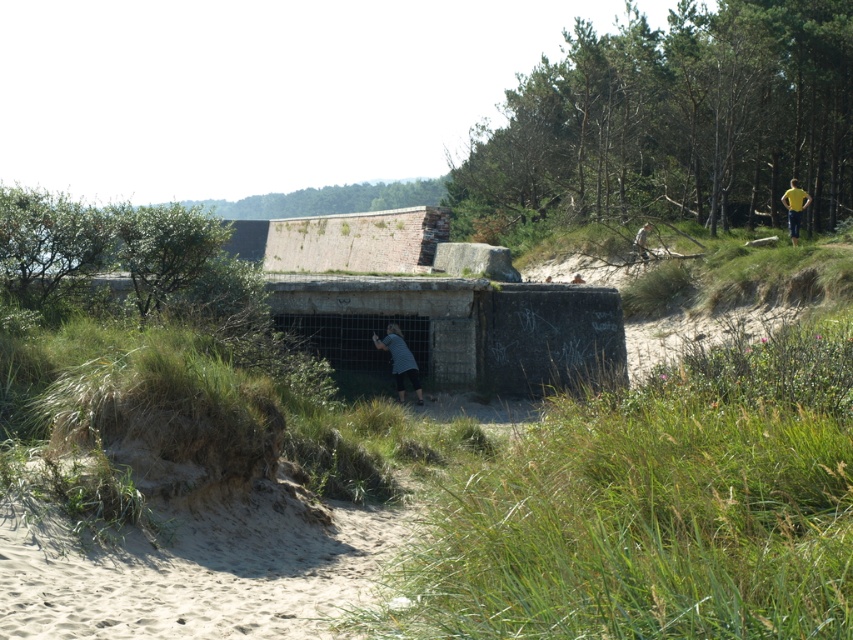
Question: Which point is farther to the camera?

Choices:
 (A) (409, 371)
 (B) (791, 196)
 (C) (642, 230)

Answer: (C)

Question: Is yellow fabric shirt at upper right above yellow shirt at upper right?

Choices:
 (A) yes
 (B) no

Answer: (A)

Question: Which object is closer to the camera taking this photo?

Choices:
 (A) yellow fabric shirt at upper right
 (B) yellow shirt at upper right

Answer: (A)

Question: Which of the following is the farthest from the observer?

Choices:
 (A) (641, 248)
 (B) (398, 371)
 (C) (795, 244)

Answer: (A)

Question: Can you confirm if gray striped shirt at center is positioned above yellow fabric shirt at upper right?

Choices:
 (A) no
 (B) yes

Answer: (A)

Question: Is gray striped shirt at center wider than yellow shirt at upper right?

Choices:
 (A) no
 (B) yes

Answer: (B)